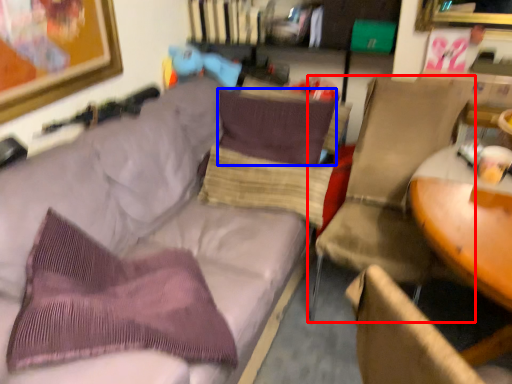
Question: Which point is closer to the camera, chair (highlighted by a red box) or pillow (highlighted by a blue box)?

Choices:
 (A) chair
 (B) pillow

Answer: (A)